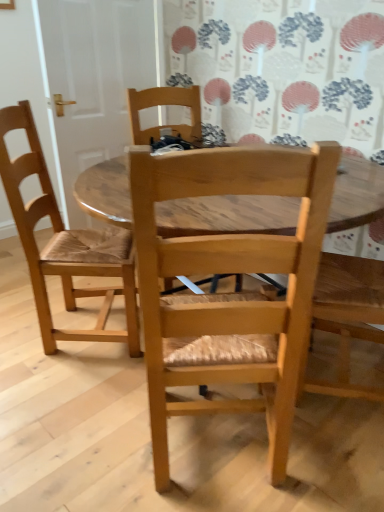
You are a GUI agent. You are given a task and a screenshot of the screen. Output one action in this format:
    pyautogui.click(x=<x>, y=<y>)
    Task: Click on the light wood/marble chair at center, the 2th chair viewed from the left
    Image resolution: width=384 pixels, height=512 pixels.
    Given the screenshot: What is the action you would take?
    pyautogui.click(x=229, y=293)

Image resolution: width=384 pixels, height=512 pixels. Describe the element at coordinates (229, 293) in the screenshot. I see `light wood/marble chair at center, the 2th chair viewed from the left` at that location.

Where is `light brown wood chair at left, arranged as the first chair when viewed from the left`? The image size is (384, 512). light brown wood chair at left, arranged as the first chair when viewed from the left is located at coordinates (65, 245).

Describe the element at coordinates (65, 245) in the screenshot. I see `light brown wood chair at left, arranged as the first chair when viewed from the left` at that location.

How much space does light brown wood chair at left, arranged as the first chair when viewed from the left, occupy horizontally?

light brown wood chair at left, arranged as the first chair when viewed from the left, is 51.59 centimeters wide.

At what (x,y) coordinates should I click in order to perform the action: click on light wood/marble chair at center, the 2th chair viewed from the left. Please return your answer as a coordinate pair (x, y). The image size is (384, 512). Looking at the image, I should click on (229, 293).

Is light wood/marble chair at center, the 2th chair viewed from the left, at the right side of light brown wood chair at left, arranged as the first chair when viewed from the left?

Yes, light wood/marble chair at center, the 2th chair viewed from the left, is to the right of light brown wood chair at left, arranged as the first chair when viewed from the left.

Between light wood/marble chair at center, which ranks as the first chair in right-to-left order, and light brown wood chair at left, which is counted as the 2th chair, starting from the right, which one is positioned behind?

light brown wood chair at left, which is counted as the 2th chair, starting from the right, is behind.

Which is less distant, (204, 401) or (5, 187)?

Point (204, 401) appears to be closer to the viewer than point (5, 187).

From the image's perspective, does light wood/marble chair at center, the 2th chair viewed from the left, appear higher than light brown wood chair at left, which is counted as the 2th chair, starting from the right?

Actually, light wood/marble chair at center, the 2th chair viewed from the left, appears below light brown wood chair at left, which is counted as the 2th chair, starting from the right, in the image.

From a real-world perspective, is light wood/marble chair at center, the 2th chair viewed from the left, below light brown wood chair at left, which is counted as the 2th chair, starting from the right?

No, from a real-world perspective, light wood/marble chair at center, the 2th chair viewed from the left, is not below light brown wood chair at left, which is counted as the 2th chair, starting from the right.

Considering the sizes of objects light wood/marble chair at center, the 2th chair viewed from the left, and light brown wood chair at left, arranged as the first chair when viewed from the left, in the image provided, who is wider, light wood/marble chair at center, the 2th chair viewed from the left, or light brown wood chair at left, arranged as the first chair when viewed from the left,?

light wood/marble chair at center, the 2th chair viewed from the left, is wider.

Is light wood/marble chair at center, which ranks as the first chair in right-to-left order, shorter than light brown wood chair at left, arranged as the first chair when viewed from the left?

No.

In terms of size, does light wood/marble chair at center, the 2th chair viewed from the left, appear bigger or smaller than light brown wood chair at left, which is counted as the 2th chair, starting from the right?

Considering their sizes, light wood/marble chair at center, the 2th chair viewed from the left, takes up more space than light brown wood chair at left, which is counted as the 2th chair, starting from the right.

Is light wood/marble chair at center, the 2th chair viewed from the left, inside the boundaries of light brown wood chair at left, arranged as the first chair when viewed from the left, or outside?

light wood/marble chair at center, the 2th chair viewed from the left, is outside light brown wood chair at left, arranged as the first chair when viewed from the left.

Is light wood/marble chair at center, which ranks as the first chair in right-to-left order, next to light brown wood chair at left, arranged as the first chair when viewed from the left?

No.

Is light wood/marble chair at center, which ranks as the first chair in right-to-left order, looking in the opposite direction of light brown wood chair at left, which is counted as the 2th chair, starting from the right?

That's not correct — light wood/marble chair at center, which ranks as the first chair in right-to-left order, is not looking away from light brown wood chair at left, which is counted as the 2th chair, starting from the right.

How far apart are light wood/marble chair at center, which ranks as the first chair in right-to-left order, and light brown wood chair at left, arranged as the first chair when viewed from the left?

light wood/marble chair at center, which ranks as the first chair in right-to-left order, and light brown wood chair at left, arranged as the first chair when viewed from the left, are 31.34 inches apart from each other.

Where is `chair directly beneath the light wood/marble chair at center, the 2th chair viewed from the left (from a real-world perspective)`? This screenshot has height=512, width=384. chair directly beneath the light wood/marble chair at center, the 2th chair viewed from the left (from a real-world perspective) is located at coordinates (65, 245).

Can you confirm if light brown wood chair at left, arranged as the first chair when viewed from the left, is positioned to the left of light wood/marble chair at center, which ranks as the first chair in right-to-left order?

Indeed, light brown wood chair at left, arranged as the first chair when viewed from the left, is positioned on the left side of light wood/marble chair at center, which ranks as the first chair in right-to-left order.

Relative to light wood/marble chair at center, which ranks as the first chair in right-to-left order, is light brown wood chair at left, arranged as the first chair when viewed from the left, in front or behind?

light brown wood chair at left, arranged as the first chair when viewed from the left, is positioned farther from the viewer than light wood/marble chair at center, which ranks as the first chair in right-to-left order.

Does point (37, 213) lie in front of point (272, 192)?

No, (37, 213) is further to viewer.

Looking at this image, from the image's perspective, between light brown wood chair at left, which is counted as the 2th chair, starting from the right, and light wood/marble chair at center, which ranks as the first chair in right-to-left order, which one is located above?

light brown wood chair at left, which is counted as the 2th chair, starting from the right, from the image's perspective.

From a real-world perspective, which object stands above the other?

From a 3D spatial view, light wood/marble chair at center, the 2th chair viewed from the left, is above.

Looking at their sizes, would you say light brown wood chair at left, arranged as the first chair when viewed from the left, is wider or thinner than light wood/marble chair at center, which ranks as the first chair in right-to-left order?

light brown wood chair at left, arranged as the first chair when viewed from the left, is thinner than light wood/marble chair at center, which ranks as the first chair in right-to-left order.

Considering the sizes of objects light brown wood chair at left, arranged as the first chair when viewed from the left, and light wood/marble chair at center, which ranks as the first chair in right-to-left order, in the image provided, who is taller, light brown wood chair at left, arranged as the first chair when viewed from the left, or light wood/marble chair at center, which ranks as the first chair in right-to-left order,?

With more height is light wood/marble chair at center, which ranks as the first chair in right-to-left order.

Who is smaller, light brown wood chair at left, arranged as the first chair when viewed from the left, or light wood/marble chair at center, the 2th chair viewed from the left?

With smaller size is light brown wood chair at left, arranged as the first chair when viewed from the left.

Is light brown wood chair at left, arranged as the first chair when viewed from the left, situated inside light wood/marble chair at center, the 2th chair viewed from the left, or outside?

light brown wood chair at left, arranged as the first chair when viewed from the left, is spatially situated outside light wood/marble chair at center, the 2th chair viewed from the left.

Is light brown wood chair at left, which is counted as the 2th chair, starting from the right, in contact with light wood/marble chair at center, which ranks as the first chair in right-to-left order?

light brown wood chair at left, which is counted as the 2th chair, starting from the right, is not next to light wood/marble chair at center, which ranks as the first chair in right-to-left order, and they're not touching.

Is light wood/marble chair at center, the 2th chair viewed from the left, at the back of light brown wood chair at left, which is counted as the 2th chair, starting from the right?

No, light brown wood chair at left, which is counted as the 2th chair, starting from the right, is not facing the opposite direction of light wood/marble chair at center, the 2th chair viewed from the left.

Can you tell me how much light brown wood chair at left, arranged as the first chair when viewed from the left, and light wood/marble chair at center, the 2th chair viewed from the left, differ in facing direction?

They differ by 90.2 degrees in their facing directions.

How much distance is there between light brown wood chair at left, which is counted as the 2th chair, starting from the right, and light wood/marble chair at center, the 2th chair viewed from the left?

31.34 inches.

Locate an element on the screen. The image size is (384, 512). chair above the light wood/marble chair at center, the 2th chair viewed from the left (from the image's perspective) is located at coordinates (65, 245).

At what (x,y) coordinates should I click in order to perform the action: click on chair lying behind the light wood/marble chair at center, which ranks as the first chair in right-to-left order. Please return your answer as a coordinate pair (x, y). The image size is (384, 512). Looking at the image, I should click on (65, 245).

The width and height of the screenshot is (384, 512). Find the location of `chair in front of the light brown wood chair at left, which is counted as the 2th chair, starting from the right`. chair in front of the light brown wood chair at left, which is counted as the 2th chair, starting from the right is located at coordinates (229, 293).